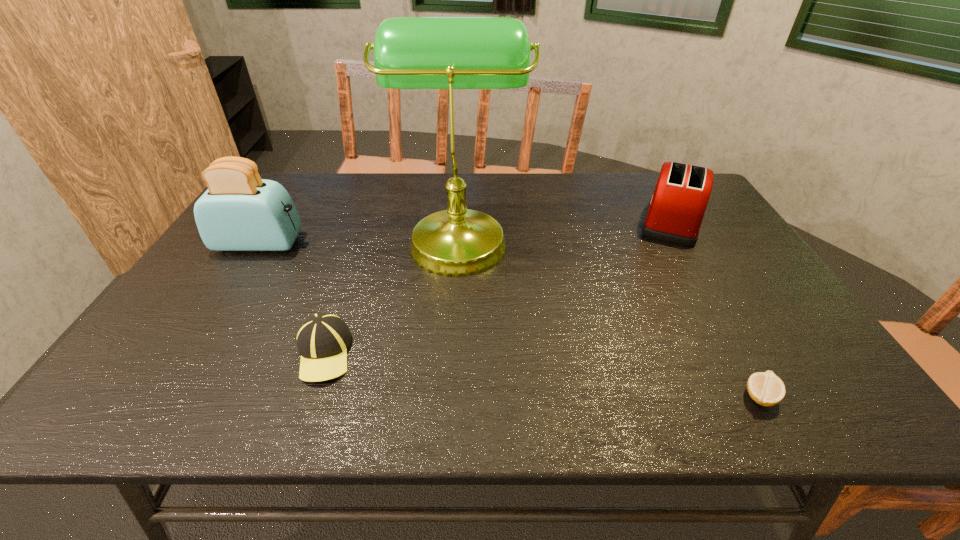
Find the location of `vacant space that satisfies the following two spatial constraints: 1. on the back side of the shortest object; 2. on the desk next to the third object from right to left`. vacant space that satisfies the following two spatial constraints: 1. on the back side of the shortest object; 2. on the desk next to the third object from right to left is located at coordinates (672, 238).

You are a GUI agent. You are given a task and a screenshot of the screen. Output one action in this format:
    pyautogui.click(x=<x>, y=<y>)
    Task: Click on the free location that satisfies the following two spatial constraints: 1. on the desk next to the third object from right to left; 2. on the back side of the shortest object
    Image resolution: width=960 pixels, height=540 pixels.
    Given the screenshot: What is the action you would take?
    pyautogui.click(x=448, y=396)

This screenshot has width=960, height=540. I want to click on vacant space that satisfies the following two spatial constraints: 1. on the side of the lemon with the lever; 2. on the right side of the taller toaster, so click(164, 396).

Locate an element on the screen. The width and height of the screenshot is (960, 540). vacant area in the image that satisfies the following two spatial constraints: 1. on the desk next to the third object from right to left; 2. on the back side of the lemon is located at coordinates (448, 396).